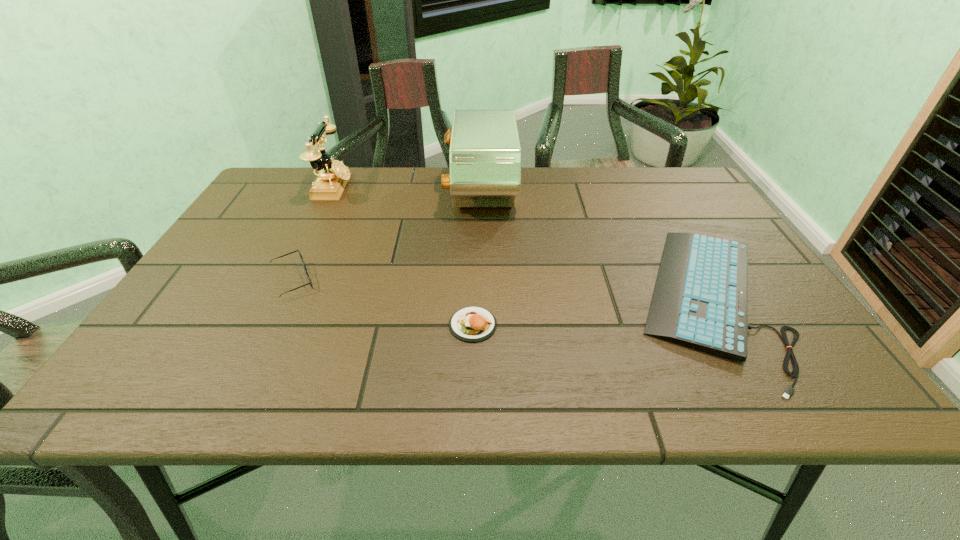
Find the location of a particular element. This screenshot has width=960, height=540. toaster oven is located at coordinates (485, 154).

I want to click on telephone, so click(333, 176).

Find the location of a particular element. This screenshot has width=960, height=540. the third shortest object is located at coordinates (300, 255).

Where is `patty (food)`? patty (food) is located at coordinates point(470,324).

Identify the location of computer keyboard. Image resolution: width=960 pixels, height=540 pixels. (700, 300).

At what (x,y) coordinates should I click in order to perform the action: click on the shortest object. Please return your answer as a coordinate pair (x, y). Looking at the image, I should click on (700, 300).

Find the location of a particular element. The width and height of the screenshot is (960, 540). vacant point located on the door side of the toaster oven is located at coordinates (331, 192).

The height and width of the screenshot is (540, 960). I want to click on free spot located on the door side of the toaster oven, so click(x=341, y=192).

Where is `vacant region located 0.190m on the door side of the toaster oven`? Image resolution: width=960 pixels, height=540 pixels. vacant region located 0.190m on the door side of the toaster oven is located at coordinates (382, 192).

You are a GUI agent. You are given a task and a screenshot of the screen. Output one action in this format:
    pyautogui.click(x=<x>, y=<y>)
    Task: Click on the vacant space located on the dial of the telephone
    
    Given the screenshot: What is the action you would take?
    pyautogui.click(x=377, y=187)